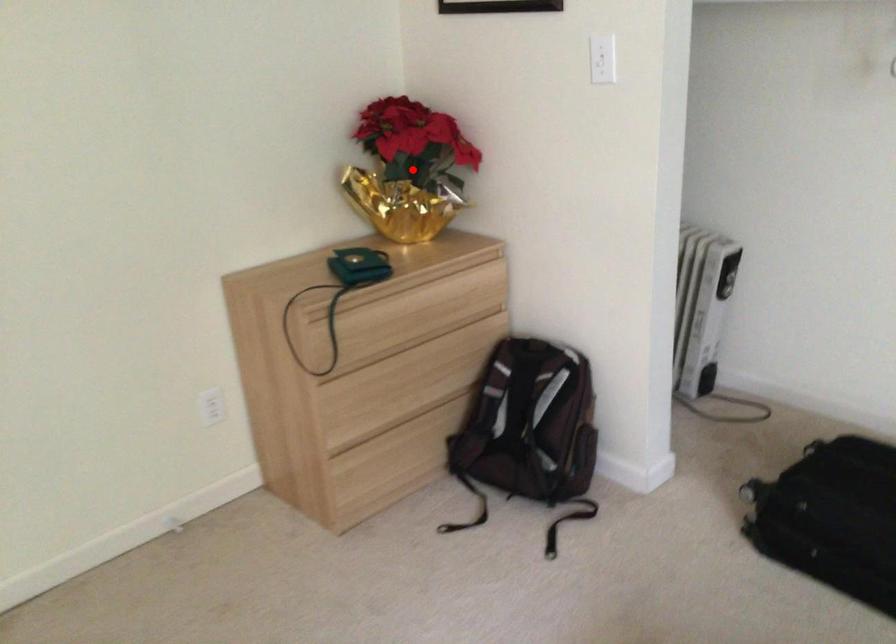
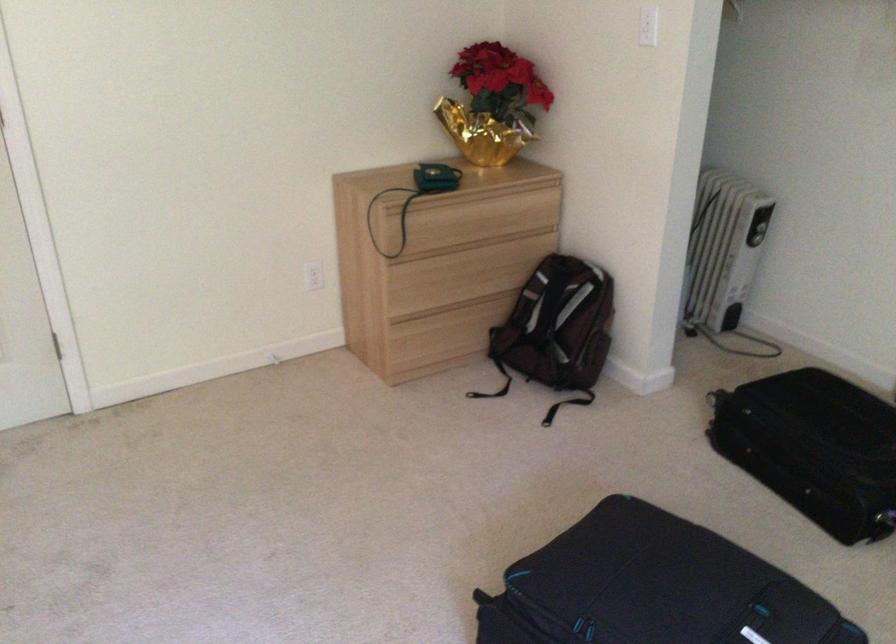
Where in the second image is the point corresponding to the highlighted location from the first image?

(493, 104)